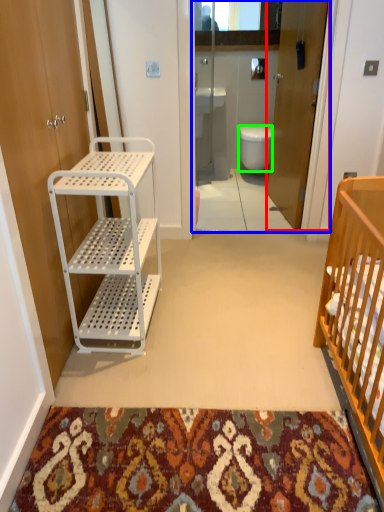
Question: Estimate the real-world distances between objects in this image. Which object is closer to door (highlighted by a red box), glass door (highlighted by a blue box) or toilet (highlighted by a green box)?

Choices:
 (A) glass door
 (B) toilet

Answer: (A)